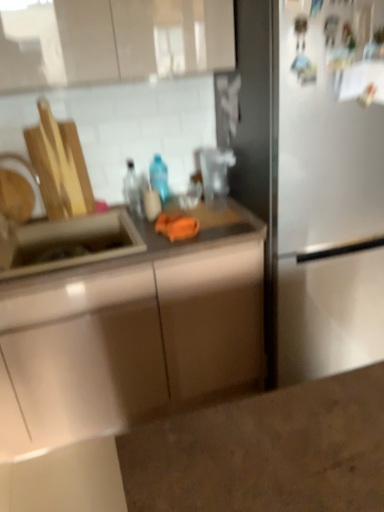
Question: In terms of height, does stainless steel sink at left look taller or shorter compared to brushed metal faucet at left?

Choices:
 (A) tall
 (B) short

Answer: (A)

Question: Visually, is stainless steel sink at left positioned to the left or to the right of brushed metal faucet at left?

Choices:
 (A) left
 (B) right

Answer: (B)

Question: Which object is the closest to the stainless steel sink at left?

Choices:
 (A) translucent plastic bottle at center, marked as the first bottle in a right-to-left arrangement
 (B) matte stainless steel sink at left
 (C) satin white fridge at right
 (D) clear glass bottle at center, the 1th bottle in the left-to-right sequence
 (E) brushed metal faucet at left

Answer: (B)

Question: Estimate the real-world distances between objects in this image. Which object is farther from the clear glass bottle at center, the 1th bottle in the left-to-right sequence?

Choices:
 (A) translucent plastic bottle at center, marked as the 2th bottle in a left-to-right arrangement
 (B) brushed metal faucet at left
 (C) matte stainless steel sink at left
 (D) satin white fridge at right
 (E) stainless steel sink at left

Answer: (D)